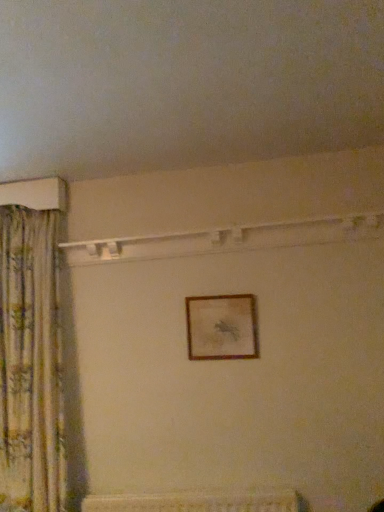
The height and width of the screenshot is (512, 384). What do you see at coordinates (31, 362) in the screenshot?
I see `floral fabric curtain at left` at bounding box center [31, 362].

This screenshot has height=512, width=384. I want to click on floral fabric curtain at left, so click(31, 362).

The width and height of the screenshot is (384, 512). Describe the element at coordinates (221, 327) in the screenshot. I see `wooden picture frame at center` at that location.

I want to click on wooden picture frame at center, so click(221, 327).

I want to click on floral fabric curtain at left, so click(x=31, y=362).

Is floral fabric curtain at left to the right of wooden picture frame at center from the viewer's perspective?

No.

Which object is further away from the camera taking this photo, floral fabric curtain at left or wooden picture frame at center?

wooden picture frame at center is more distant.

Which point is more forward, (x=17, y=318) or (x=241, y=337)?

The point (x=241, y=337) is closer to the camera.

From the image's perspective, does floral fabric curtain at left appear lower than wooden picture frame at center?

Correct, floral fabric curtain at left appears lower than wooden picture frame at center in the image.

From a real-world perspective, is floral fabric curtain at left over wooden picture frame at center?

Answer: No, from a real-world perspective, floral fabric curtain at left is not on top of wooden picture frame at center.

Can you confirm if floral fabric curtain at left is wider than wooden picture frame at center?

Yes.

Does floral fabric curtain at left have a lesser height compared to wooden picture frame at center?

No, floral fabric curtain at left is not shorter than wooden picture frame at center.

Which of these two, floral fabric curtain at left or wooden picture frame at center, is smaller?

wooden picture frame at center.

Can we say floral fabric curtain at left lies outside wooden picture frame at center?

floral fabric curtain at left lies outside wooden picture frame at center's area.

Can you see floral fabric curtain at left touching wooden picture frame at center?

No, floral fabric curtain at left is not with wooden picture frame at center.

Is floral fabric curtain at left aimed at wooden picture frame at center?

No, floral fabric curtain at left is not oriented towards wooden picture frame at center.

How different are the orientations of floral fabric curtain at left and wooden picture frame at center in degrees?

floral fabric curtain at left and wooden picture frame at center are facing 0.00753 degrees away from each other.

Measure the distance between floral fabric curtain at left and wooden picture frame at center.

37.83 inches.

Identify the location of picture frame above the floral fabric curtain at left (from a real-world perspective). The height and width of the screenshot is (512, 384). (221, 327).

Between wooden picture frame at center and floral fabric curtain at left, which one appears on the left side from the viewer's perspective?

From the viewer's perspective, floral fabric curtain at left appears more on the left side.

In the scene shown: Is wooden picture frame at center behind floral fabric curtain at left?

Yes.

Is point (207, 307) closer or farther from the camera than point (52, 309)?

Clearly, point (207, 307) is more distant from the camera than point (52, 309).

From the image's perspective, is wooden picture frame at center above or below floral fabric curtain at left?

wooden picture frame at center is above floral fabric curtain at left.

From a real-world perspective, is wooden picture frame at center above or below floral fabric curtain at left?

From a real-world perspective, wooden picture frame at center is physically above floral fabric curtain at left.

Does wooden picture frame at center have a lesser width compared to floral fabric curtain at left?

Yes, wooden picture frame at center is thinner than floral fabric curtain at left.

Is wooden picture frame at center taller than floral fabric curtain at left?

No, wooden picture frame at center is not taller than floral fabric curtain at left.

Which of these two, wooden picture frame at center or floral fabric curtain at left, is smaller?

wooden picture frame at center is smaller.

Can floral fabric curtain at left be found inside wooden picture frame at center?

No, floral fabric curtain at left is not surrounded by wooden picture frame at center.

Is wooden picture frame at center not near floral fabric curtain at left?

They are positioned close to each other.

Is wooden picture frame at center facing away from floral fabric curtain at left?

No.

Locate an element on the screen. picture frame lying on the right of floral fabric curtain at left is located at coordinates (221, 327).

Identify the location of picture frame above the floral fabric curtain at left (from a real-world perspective). The height and width of the screenshot is (512, 384). (221, 327).

Locate an element on the screen. Image resolution: width=384 pixels, height=512 pixels. picture frame lying on the right of floral fabric curtain at left is located at coordinates (221, 327).